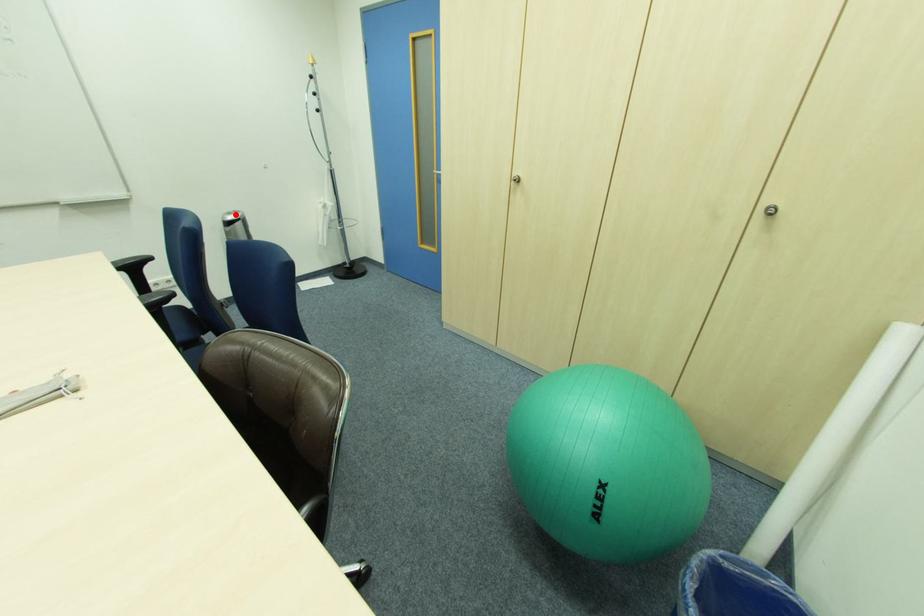
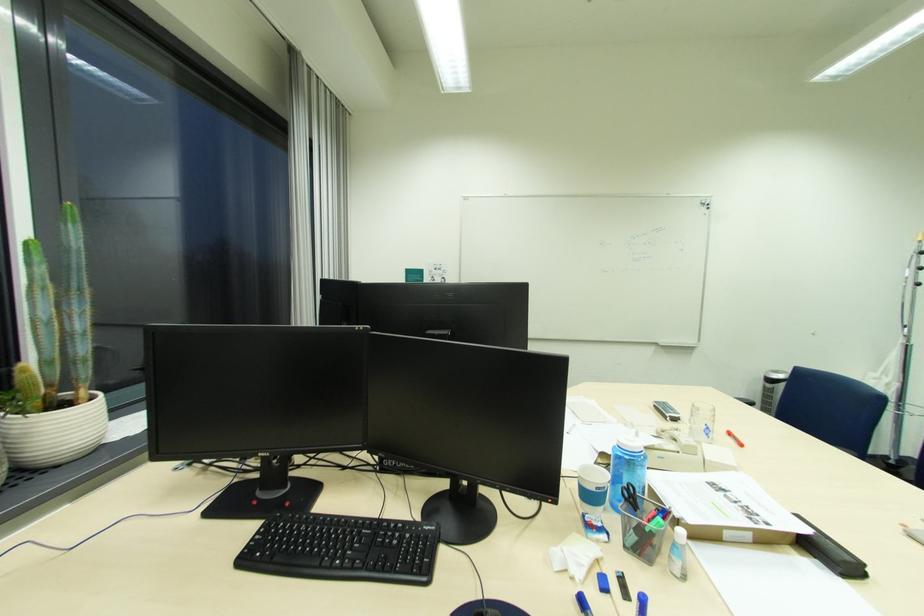
Question: A red point is marked in image1. In image2, is the corresponding 3D point closer to the camera or farther? Reply with the corresponding letter.

Choices:
 (A) The corresponding 3D point is closer.
 (B) The corresponding 3D point is farther.

Answer: (B)